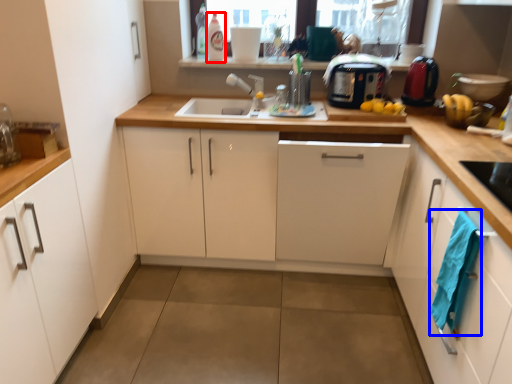
Question: Among these objects, which one is nearest to the camera, bottle (highlighted by a red box) or laundry (highlighted by a blue box)?

Choices:
 (A) bottle
 (B) laundry

Answer: (B)